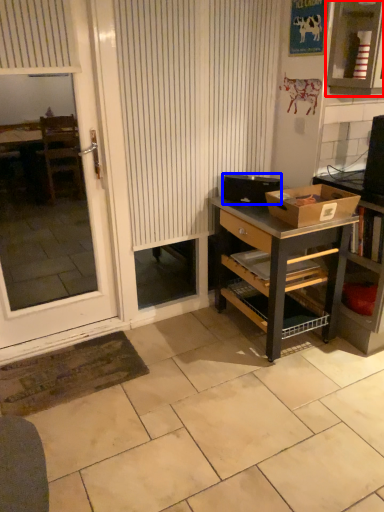
Question: Which object appears closest to the camera in this image, cabinetry (highlighted by a red box) or box (highlighted by a blue box)?

Choices:
 (A) cabinetry
 (B) box

Answer: (A)